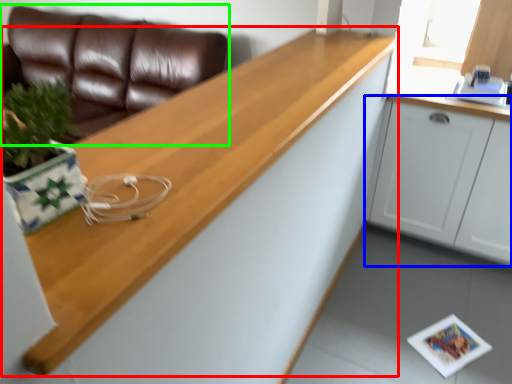
Question: Which is nearer to the countertop (highlighted by a red box)? cabinetry (highlighted by a blue box) or studio couch (highlighted by a green box).

Choices:
 (A) cabinetry
 (B) studio couch

Answer: (A)